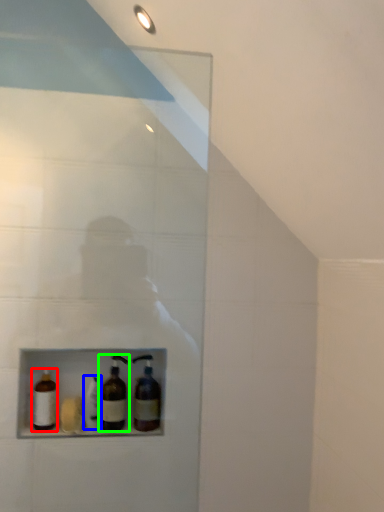
Question: Based on their relative distances, which object is nearer to bottle (highlighted by a red box)? Choose from bottle (highlighted by a blue box) and bottle (highlighted by a green box).

Choices:
 (A) bottle
 (B) bottle

Answer: (A)